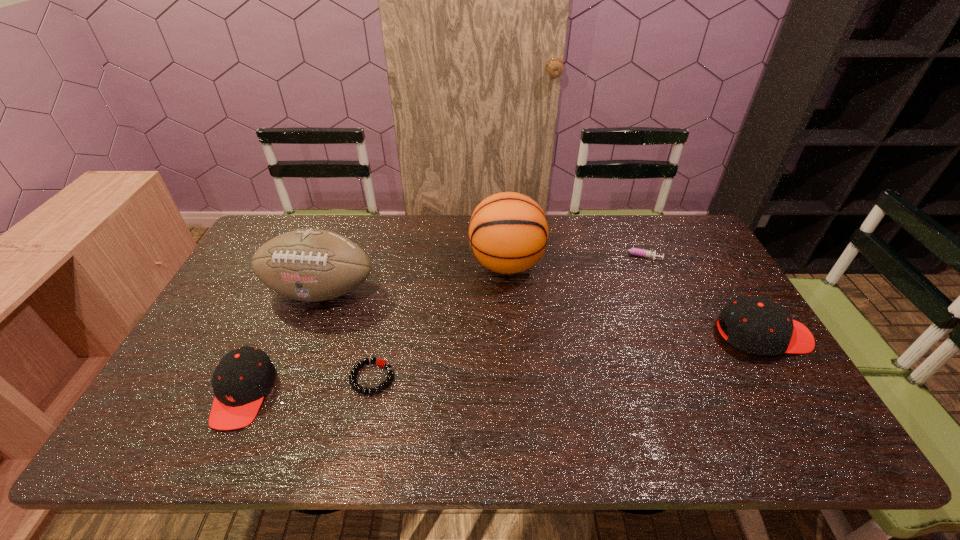
If we want them evenly spaced by inserting an extra cap_(headwear) among them, please locate a free spot for this new cap_(headwear). Please provide its 2D coordinates. Your answer should be formatted as a tuple, i.e. [(x, y)], where the tuple contains the x and y coordinates of a point satisfying the conditions above.

[(518, 362)]